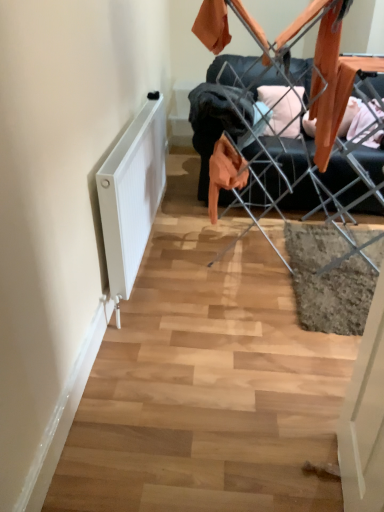
Question: Does point (145, 110) appear closer or farther from the camera than point (231, 55)?

Choices:
 (A) closer
 (B) farther

Answer: (A)

Question: Considering the positions of white matte radiator at lower left and metal wire laundry rack at center in the image, is white matte radiator at lower left bigger or smaller than metal wire laundry rack at center?

Choices:
 (A) small
 (B) big

Answer: (A)

Question: Choose the correct answer: Is white matte radiator at lower left inside metal wire laundry rack at center or outside it?

Choices:
 (A) inside
 (B) outside

Answer: (B)

Question: Is metal wire laundry rack at center in front of or behind white matte radiator at lower left in the image?

Choices:
 (A) front
 (B) behind

Answer: (B)

Question: Considering the relative positions of metal wire laundry rack at center and white matte radiator at lower left in the image provided, is metal wire laundry rack at center to the left or to the right of white matte radiator at lower left?

Choices:
 (A) right
 (B) left

Answer: (A)

Question: From a real-world perspective, is metal wire laundry rack at center physically located above or below white matte radiator at lower left?

Choices:
 (A) below
 (B) above

Answer: (B)

Question: Is metal wire laundry rack at center wider or thinner than white matte radiator at lower left?

Choices:
 (A) thin
 (B) wide

Answer: (B)